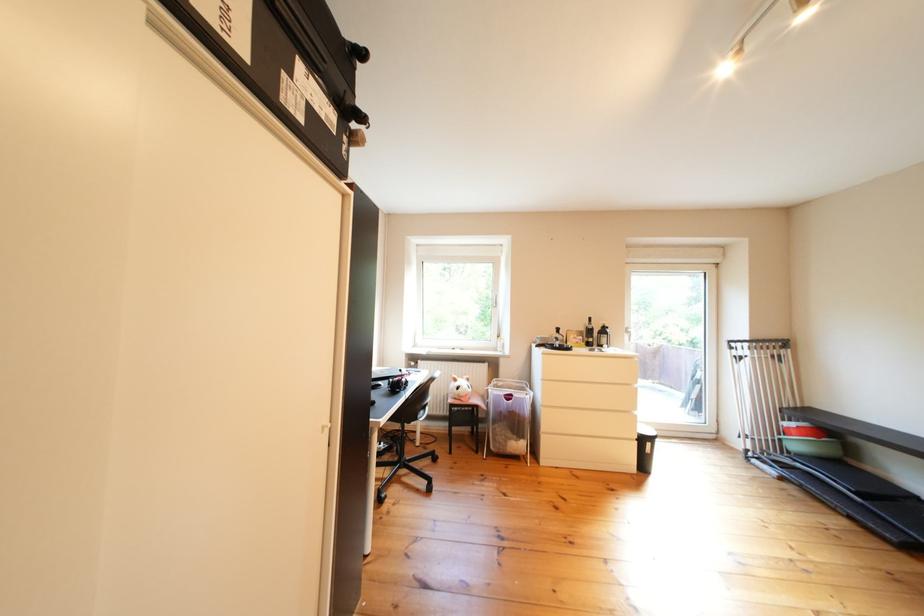
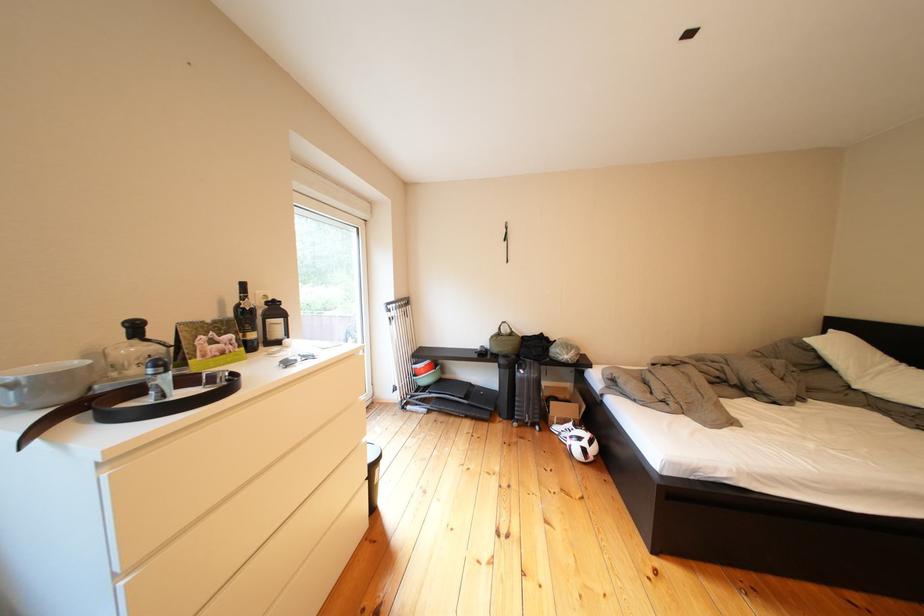
Locate, in the second image, the point that corresponds to pixel 882 474 in the first image.

(462, 381)